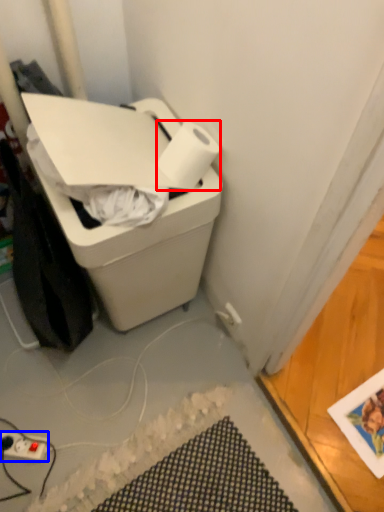
Question: Which of the following is the closest to the observer, paper towel (highlighted by a red box) or power plugs and sockets (highlighted by a blue box)?

Choices:
 (A) paper towel
 (B) power plugs and sockets

Answer: (A)